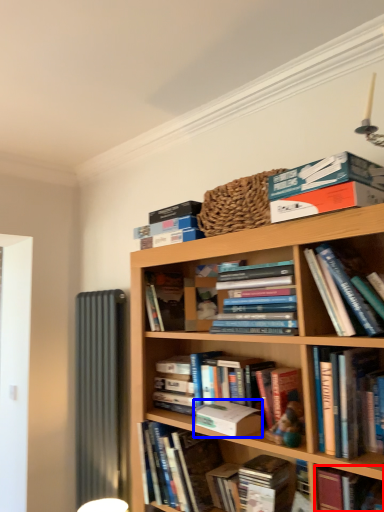
Question: Which point is closer to the camera, book (highlighted by a red box) or paperback book (highlighted by a blue box)?

Choices:
 (A) book
 (B) paperback book

Answer: (A)